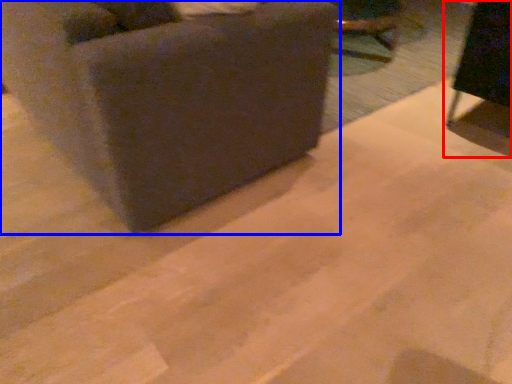
Question: Among these objects, which one is nearest to the camera, furniture (highlighted by a red box) or furniture (highlighted by a blue box)?

Choices:
 (A) furniture
 (B) furniture

Answer: (B)